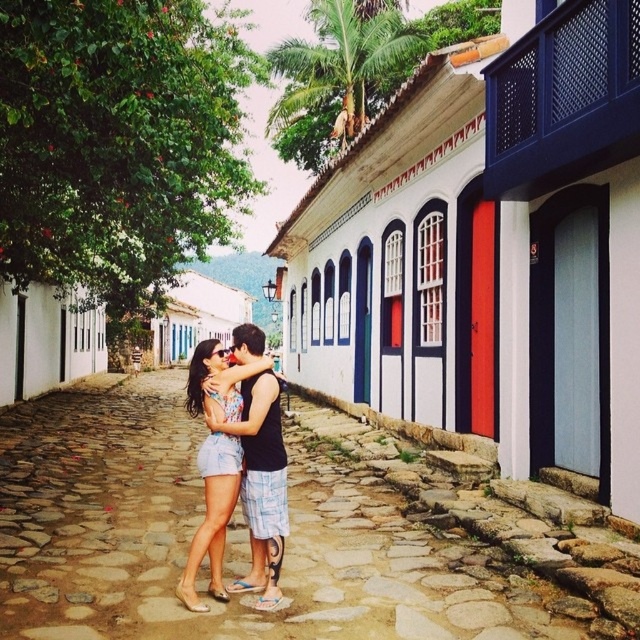
Based on the photo, is smooth stone alley at center smaller than denim shorts at center?

Incorrect, smooth stone alley at center is not smaller in size than denim shorts at center.

Is point (68, 534) positioned before point (189, 412)?

Yes, it is in front of point (189, 412).

Find the location of a particular element. The width and height of the screenshot is (640, 640). smooth stone alley at center is located at coordinates (289, 538).

In order to click on smooth stone alley at center in this screenshot , I will do `click(289, 538)`.